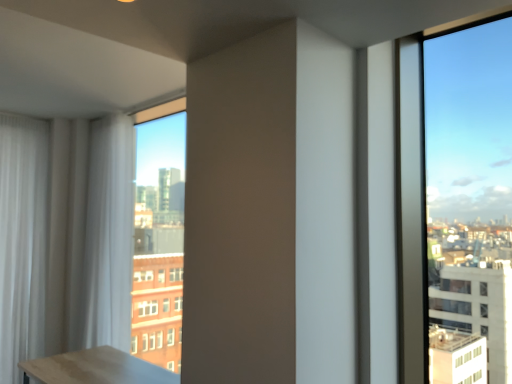
Locate an element on the screen. free space above white sheer curtain at left, which is counted as the first curtain, starting from the right (from a real-world perspective) is located at coordinates (100, 111).